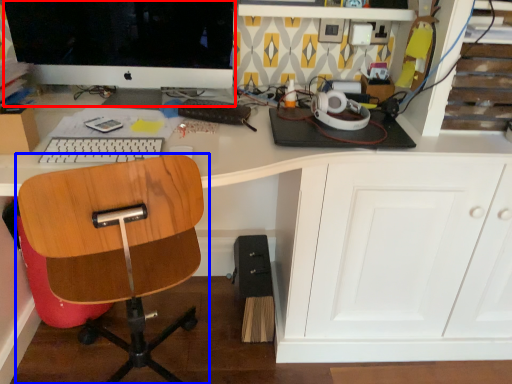
Question: Which point is further to the camera, computer monitor (highlighted by a red box) or chair (highlighted by a blue box)?

Choices:
 (A) computer monitor
 (B) chair

Answer: (A)